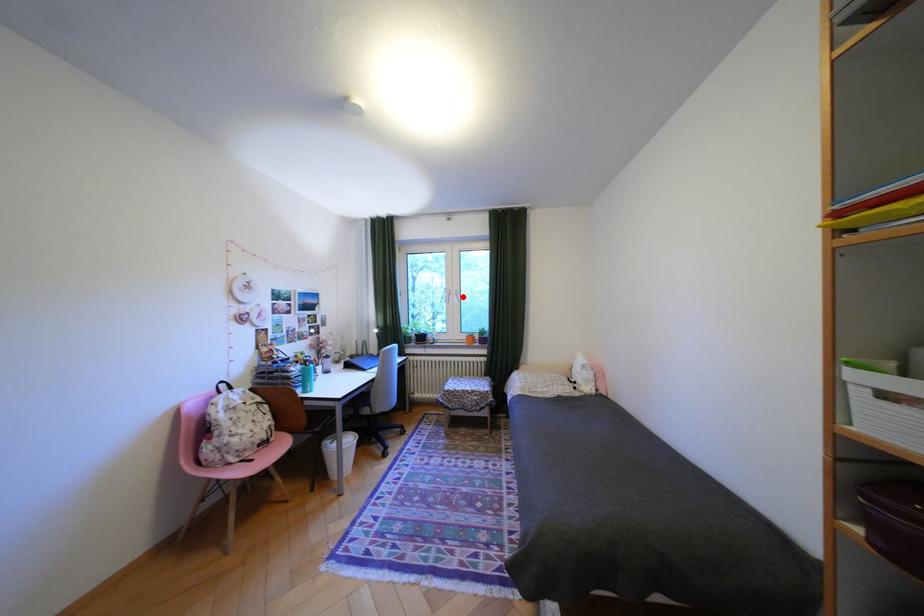
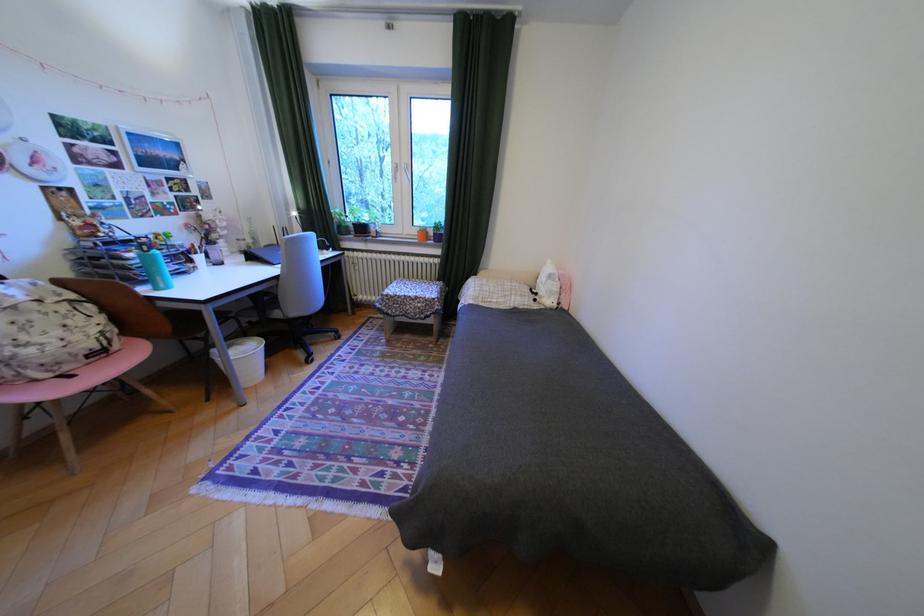
Question: I am providing you with two images of the same scene from different viewpoints. Image1 has a red point marked. In image2, the corresponding 3D location appears at what relative position? Reply with the corresponding letter.

Choices:
 (A) Closer
 (B) Farther

Answer: (A)